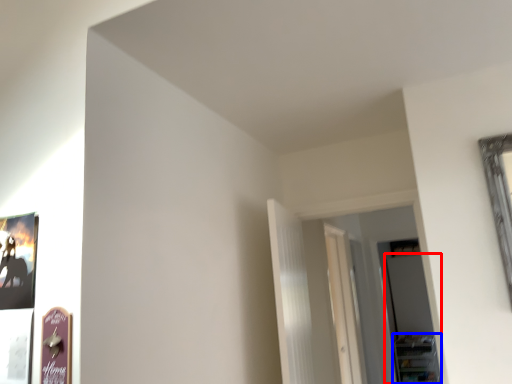
Question: Which point is further to the camera, glass door (highlighted by a red box) or shelf (highlighted by a blue box)?

Choices:
 (A) glass door
 (B) shelf

Answer: (B)